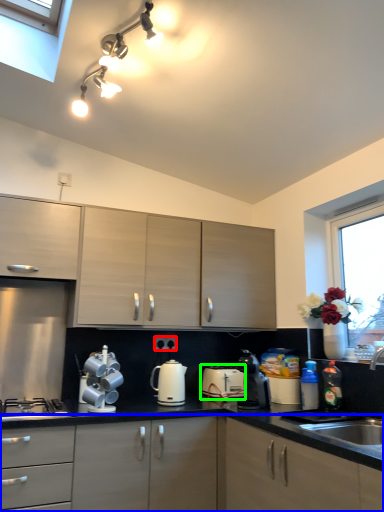
Question: Considering the real-world distances, which object is closest to electric outlet (highlighted by a red box)? cabinetry (highlighted by a blue box) or appliance (highlighted by a green box).

Choices:
 (A) cabinetry
 (B) appliance

Answer: (B)